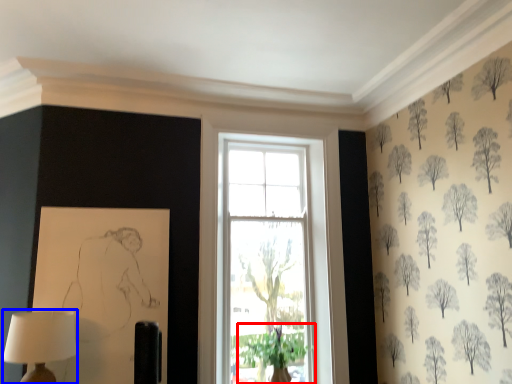
Question: Among these objects, which one is farthest to the camera, plant (highlighted by a red box) or table lamp (highlighted by a blue box)?

Choices:
 (A) plant
 (B) table lamp

Answer: (A)